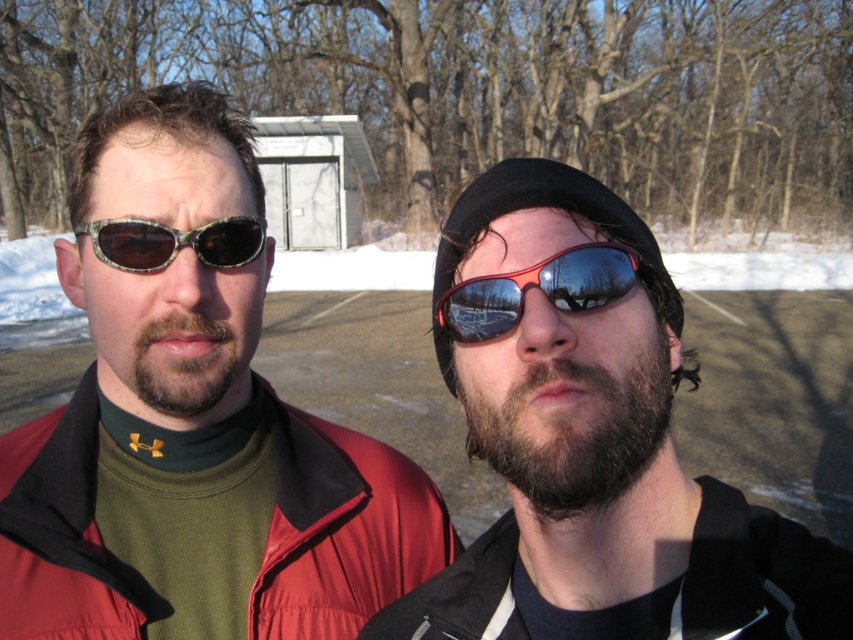
Is point (701, 552) behind point (219, 252)?

No, (701, 552) is closer to viewer.

Who is shorter, black fleece jacket at lower right or camouflage-patterned sunglasses at left?

Standing shorter between the two is camouflage-patterned sunglasses at left.

Does point (706, 516) lie in front of point (132, 237)?

Yes, it is.

Locate an element on the screen. The width and height of the screenshot is (853, 640). black fleece jacket at lower right is located at coordinates (759, 576).

At what (x,y) coordinates should I click in order to perform the action: click on shiny red plastic goggles at center. Please return your answer as a coordinate pair (x, y). Looking at the image, I should click on (538, 285).

Who is higher up, shiny red plastic goggles at center or camouflage-patterned sunglasses at left?

camouflage-patterned sunglasses at left is higher up.

Who is more forward, (612, 291) or (241, 241)?

Point (612, 291)

Identify the location of shiny red plastic goggles at center. (538, 285).

Is black fleece jacket at lower right closer to camera compared to shiny red plastic goggles at center?

Yes, black fleece jacket at lower right is in front of shiny red plastic goggles at center.

Which of these two, black fleece jacket at lower right or shiny red plastic goggles at center, stands shorter?

Standing shorter between the two is shiny red plastic goggles at center.

Does point (816, 624) come behind point (561, 292)?

No.

Identify the location of black fleece jacket at lower right. (759, 576).